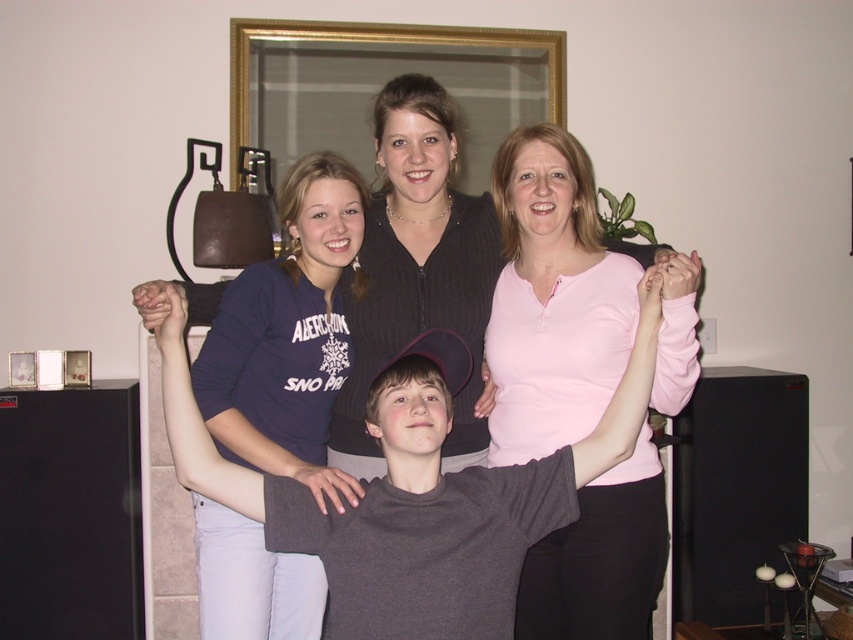
You are a photographer arranging a group photo in a living room with a fireplace. You notice the pink soft fabric shirt at upper center and the dark gray cotton shirt at center. Which shirt is covering part of the other?

The pink soft fabric shirt at upper center is positioned over the dark gray cotton shirt at center, so it is covering part of it.

You are trying to decide which of the two shirts, the dark gray cotton shirt at center or the dark blue jersey at center, would be more suitable to wear for a casual dinner date. Based on their appearance in the image, which one seems more appropriate?

The dark gray cotton shirt at center is wider than the dark blue jersey at center, making it a more casual and comfortable option for a dinner date.

You are trying to decide which shirt to wear for an event. Both the pink soft fabric shirt at upper center and the dark gray cotton shirt at center are options. Based on their sizes, which one is narrower?

The pink soft fabric shirt at upper center is narrower than the dark gray cotton shirt at center.